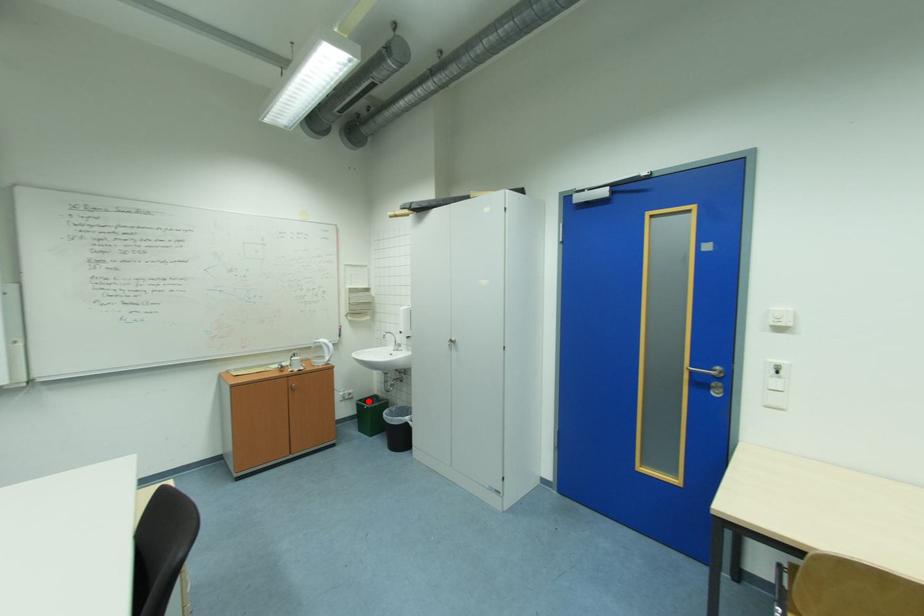
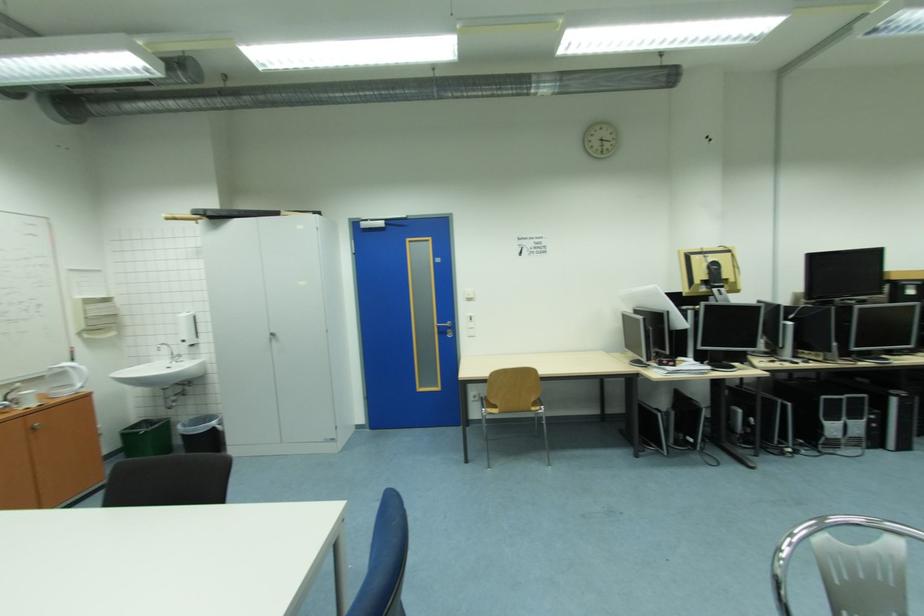
Question: A red point is marked in image1. In image2, is the corresponding 3D point closer to the camera or farther? Reply with the corresponding letter.

Choices:
 (A) The corresponding 3D point is closer.
 (B) The corresponding 3D point is farther.

Answer: (A)